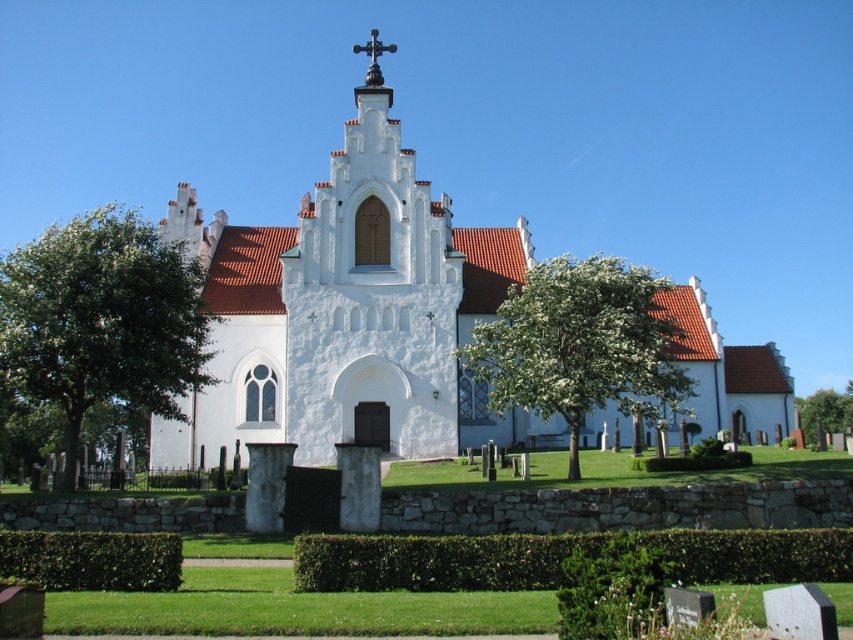
Is green leafy tree at left taller than white blossoming tree at center?

Yes.

Which of these two, green leafy tree at left or white blossoming tree at center, stands taller?

With more height is green leafy tree at left.

Where is `green leafy tree at left`? green leafy tree at left is located at coordinates (102, 317).

Identify the location of green leafy tree at left. The image size is (853, 640). (102, 317).

Is white blossoming tree at center to the left of green leafy tree at center from the viewer's perspective?

Indeed, white blossoming tree at center is positioned on the left side of green leafy tree at center.

Does point (579, 404) come behind point (822, 403)?

No.

The width and height of the screenshot is (853, 640). Identify the location of white blossoming tree at center. (579, 344).

Can you confirm if green leafy hedge at lower center is bigger than green leafy tree at center?

No, green leafy hedge at lower center is not bigger than green leafy tree at center.

Who is more distant from viewer, (718, 566) or (840, 422)?

The point (840, 422) is more distant.

The height and width of the screenshot is (640, 853). Find the location of `green leafy hedge at lower center`. green leafy hedge at lower center is located at coordinates click(x=434, y=561).